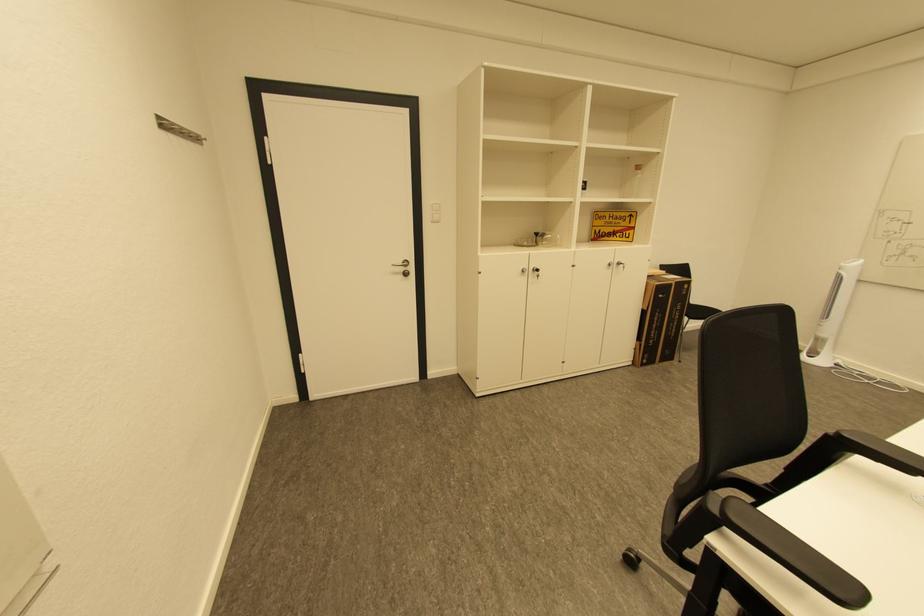
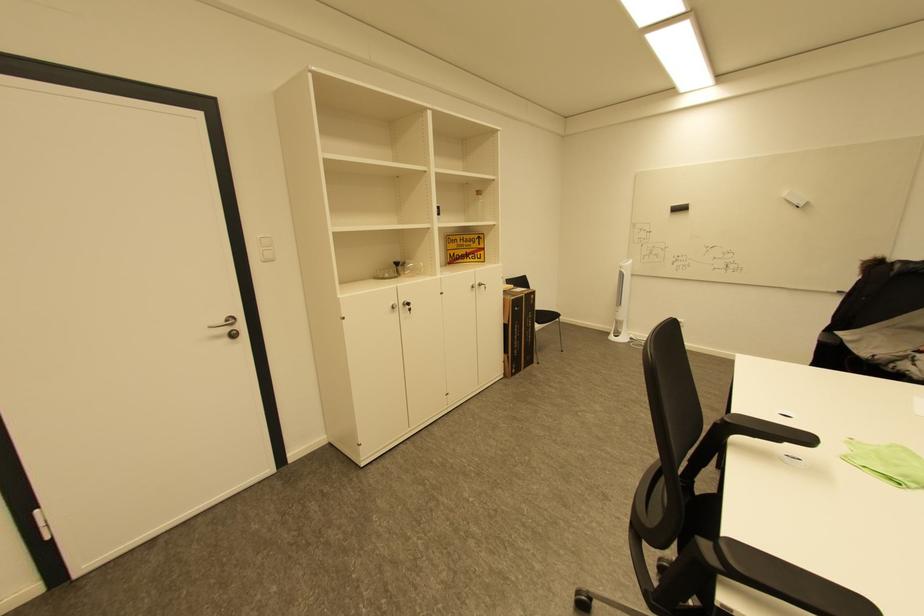
The point at (615,265) is marked in the first image. Where is the corresponding point in the second image?

(479, 286)